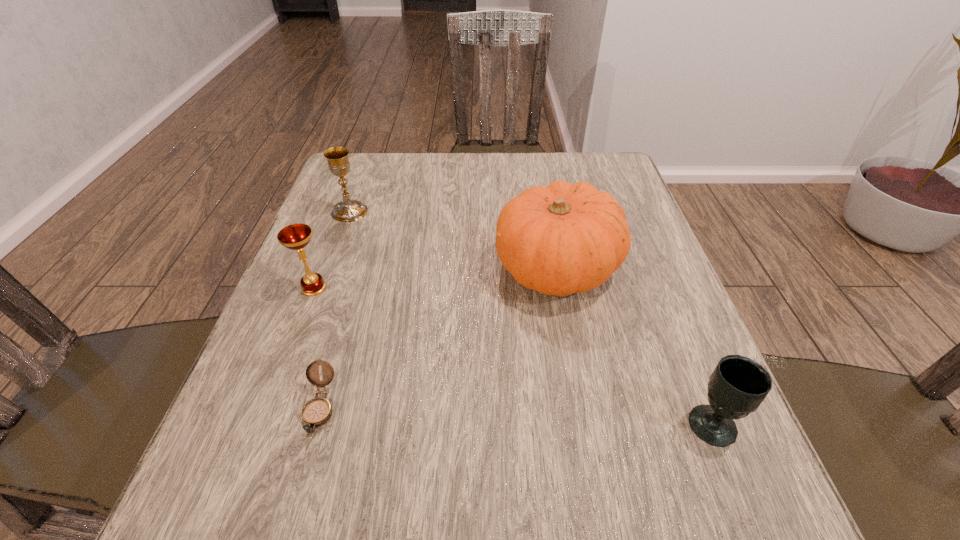
Locate which object ranks third in proximity to the farthest object. Please provide its 2D coordinates. Your answer should be formatted as a tuple, i.e. [(x, y)], where the tuple contains the x and y coordinates of a point satisfying the conditions above.

[(316, 412)]

The height and width of the screenshot is (540, 960). I want to click on object that is the closest to the fourth object from left to right, so click(738, 385).

At what (x,y) coordinates should I click in order to perform the action: click on chalice that stands as the closest to the second farthest chalice. Please return your answer as a coordinate pair (x, y). This screenshot has width=960, height=540. Looking at the image, I should click on (348, 210).

Point out which chalice is positioned as the second nearest to the second nearest chalice. Please provide its 2D coordinates. Your answer should be formatted as a tuple, i.e. [(x, y)], where the tuple contains the x and y coordinates of a point satisfying the conditions above.

[(738, 385)]

This screenshot has height=540, width=960. I want to click on vacant space that satisfies the following two spatial constraints: 1. on the face of the shortest object; 2. on the right side of the rightmost chalice, so pyautogui.click(x=315, y=424).

At what (x,y) coordinates should I click in order to perform the action: click on free region that satisfies the following two spatial constraints: 1. on the back side of the farthest object; 2. on the right side of the second farthest chalice. Please return your answer as a coordinate pair (x, y). This screenshot has height=540, width=960. Looking at the image, I should click on (343, 212).